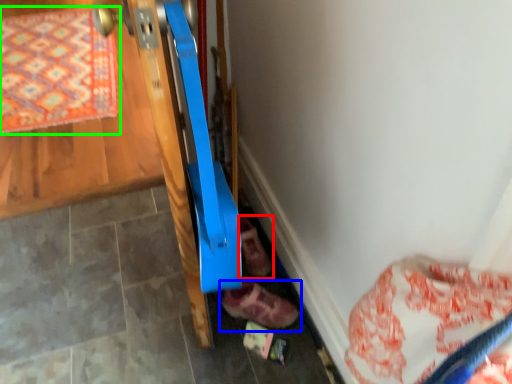
Question: Which is farther away from footwear (highlighted by a red box)? footwear (highlighted by a blue box) or mat (highlighted by a green box)?

Choices:
 (A) footwear
 (B) mat

Answer: (B)